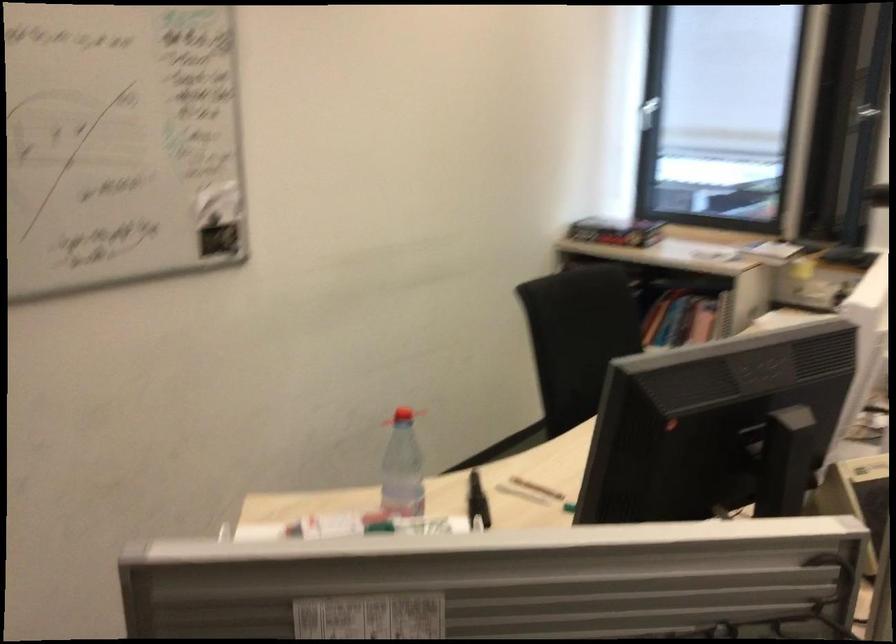
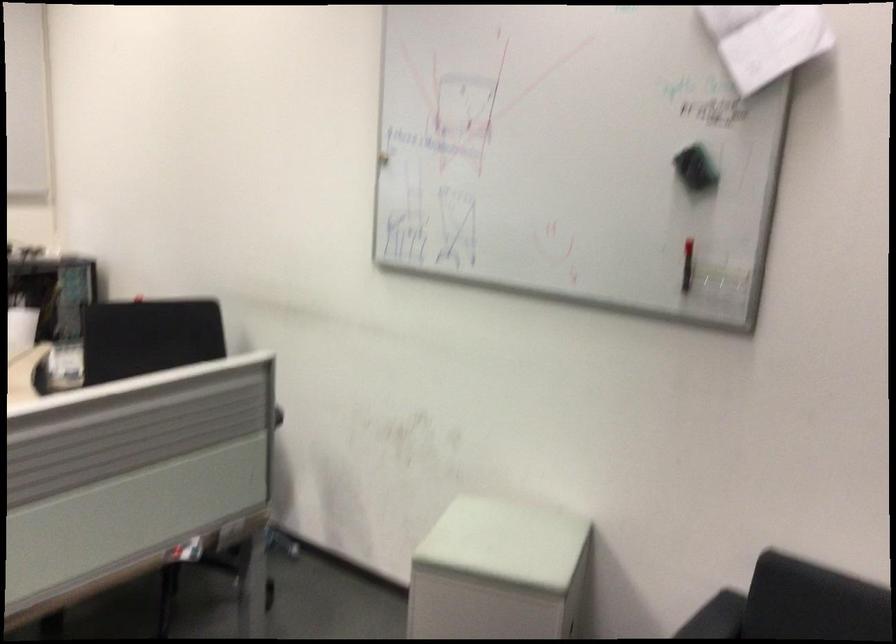
Question: Based on the continuous images, in which direction is the camera rotating? Reply with the corresponding letter.

Choices:
 (A) Left
 (B) Right
 (C) Up
 (D) Down

Answer: (B)